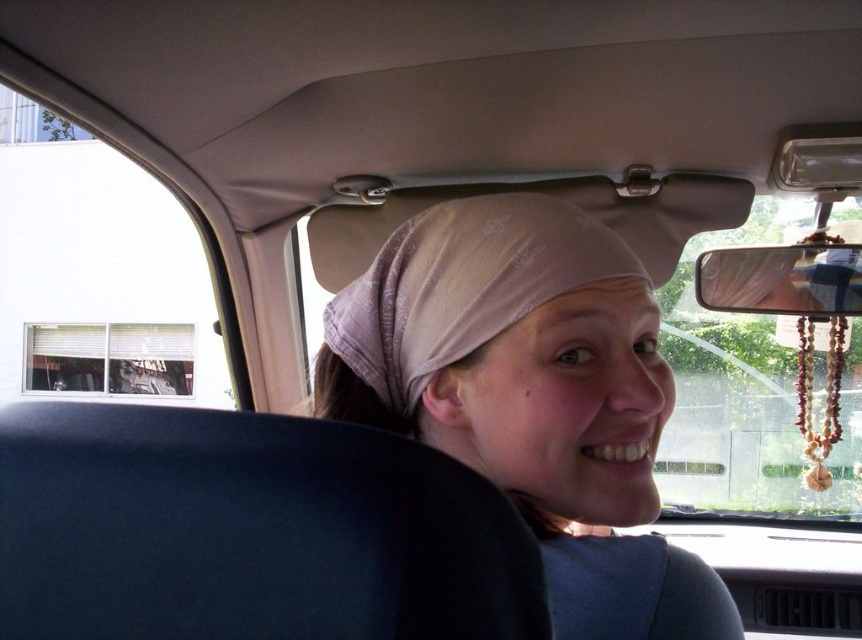
Which of these two, translucent glass car window at right or brown wooden beads at right, stands shorter?

Standing shorter between the two is brown wooden beads at right.

Can you confirm if translucent glass car window at right is positioned to the left of brown wooden beads at right?

In fact, translucent glass car window at right is to the right of brown wooden beads at right.

Locate an element on the screen. This screenshot has width=862, height=640. translucent glass car window at right is located at coordinates (748, 394).

Locate an element on the screen. translucent glass car window at right is located at coordinates (748, 394).

Looking at this image, can you confirm if pale pink sheer fabric headscarf at center is thinner than brown wooden beads at right?

Correct, pale pink sheer fabric headscarf at center's width is less than brown wooden beads at right's.

Is pale pink sheer fabric headscarf at center positioned behind brown wooden beads at right?

No, pale pink sheer fabric headscarf at center is in front of brown wooden beads at right.

Locate an element on the screen. The height and width of the screenshot is (640, 862). pale pink sheer fabric headscarf at center is located at coordinates (461, 285).

Where is `pale pink sheer fabric headscarf at center`? This screenshot has height=640, width=862. pale pink sheer fabric headscarf at center is located at coordinates (461, 285).

Between point (754, 392) and point (553, 248), which one is positioned behind?

The point (754, 392) is more distant.

Is translucent glass car window at right wider than pale pink sheer fabric headscarf at center?

Yes.

Is point (801, 212) less distant than point (423, 214)?

That is False.

You are a GUI agent. You are given a task and a screenshot of the screen. Output one action in this format:
    pyautogui.click(x=<x>, y=<y>)
    Task: Click on the translucent glass car window at right
    The height and width of the screenshot is (640, 862).
    Given the screenshot: What is the action you would take?
    pyautogui.click(x=748, y=394)